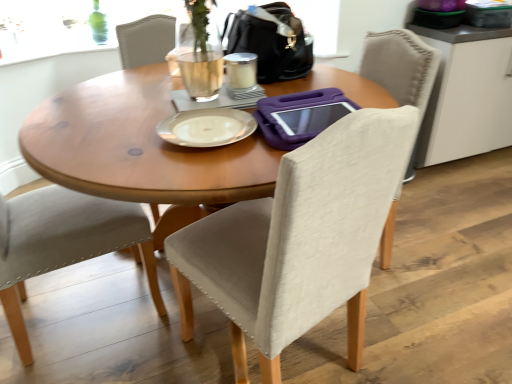
Question: From the image's perspective, is beige fabric chair at center, the 1th chair when ordered from right to left, located above black leather handbag at upper center?

Choices:
 (A) no
 (B) yes

Answer: (A)

Question: Is the depth of beige fabric chair at center, the 1th chair when ordered from right to left, less than that of black leather handbag at upper center?

Choices:
 (A) yes
 (B) no

Answer: (A)

Question: Would you consider beige fabric chair at center, which is counted as the 2th chair, starting from the left, to be distant from black leather handbag at upper center?

Choices:
 (A) yes
 (B) no

Answer: (B)

Question: Is beige fabric chair at center, the 1th chair when ordered from right to left, thinner than black leather handbag at upper center?

Choices:
 (A) no
 (B) yes

Answer: (A)

Question: From the image's perspective, is beige fabric chair at center, the 1th chair when ordered from right to left, below black leather handbag at upper center?

Choices:
 (A) no
 (B) yes

Answer: (B)

Question: Is beige fabric chair at center, the 1th chair when ordered from right to left, to the left of black leather handbag at upper center from the viewer's perspective?

Choices:
 (A) no
 (B) yes

Answer: (A)

Question: Is the depth of light beige fabric chair at left, which is the first chair in left-to-right order, greater than that of white matte cabinet at upper right?

Choices:
 (A) no
 (B) yes

Answer: (A)

Question: From the image's perspective, would you say light beige fabric chair at left, which appears as the 2th chair when viewed from the right, is shown under white matte cabinet at upper right?

Choices:
 (A) no
 (B) yes

Answer: (B)

Question: Can you confirm if light beige fabric chair at left, which appears as the 2th chair when viewed from the right, is positioned to the left of white matte cabinet at upper right?

Choices:
 (A) no
 (B) yes

Answer: (B)

Question: Is light beige fabric chair at left, which is the first chair in left-to-right order, located outside white matte cabinet at upper right?

Choices:
 (A) yes
 (B) no

Answer: (A)

Question: Is light beige fabric chair at left, which appears as the 2th chair when viewed from the right, thinner than white matte cabinet at upper right?

Choices:
 (A) no
 (B) yes

Answer: (A)

Question: Considering the relative positions of light beige fabric chair at left, which appears as the 2th chair when viewed from the right, and white matte cabinet at upper right in the image provided, is light beige fabric chair at left, which appears as the 2th chair when viewed from the right, in front of white matte cabinet at upper right?

Choices:
 (A) yes
 (B) no

Answer: (A)

Question: Would you say white matte cabinet at upper right is a long distance from beige fabric chair at center, which is counted as the 2th chair, starting from the left?

Choices:
 (A) no
 (B) yes

Answer: (B)